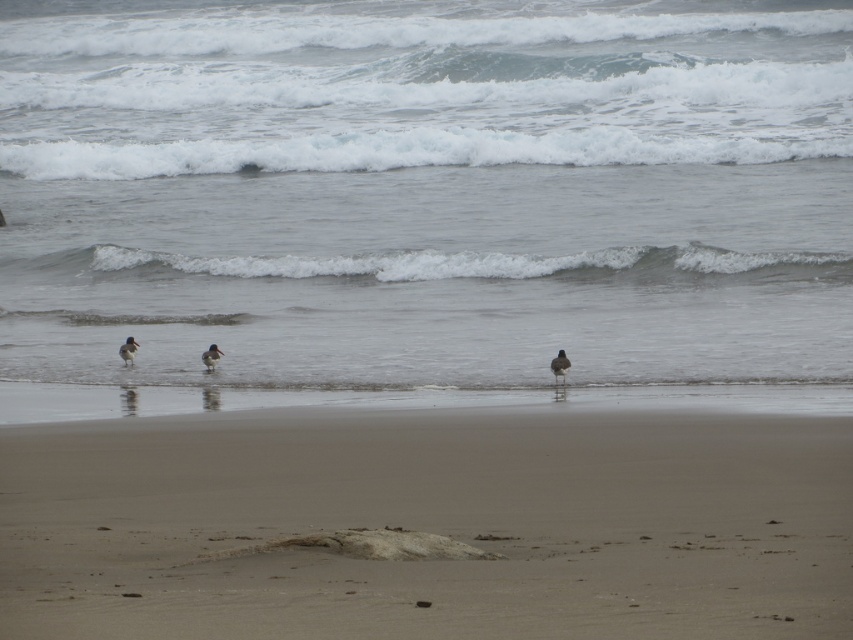
You are standing on the beach and see the brown speckled feather at center and the brown speckled feathered bird at center. Which object is positioned to the right of the other?

The brown speckled feather at center is to the right of the brown speckled feathered bird at center.

You are a photographer trying to capture the white frothy wave at center and the brown speckled beak at left in the same frame. Based on their sizes, which object should you focus on first to ensure both are clearly visible in your photo?

The white frothy wave at center is larger than the brown speckled beak at left, so you should focus on the white frothy wave at center first to ensure both are clearly visible in your photo.

You are a birdwatcher trying to identify the size of the brown speckled feather at center and the brown speckled feathered bird at center in the beach scene. Based on the description provided, which object is smaller in width?

The brown speckled feather at center is smaller in width compared to the brown speckled feathered bird at center, as the feather is described to have a width less than that of the bird.